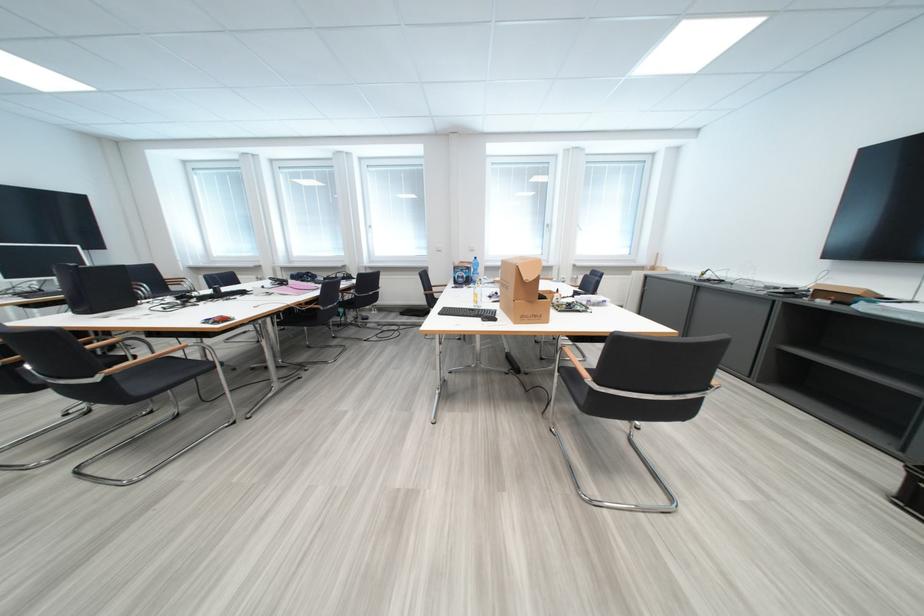
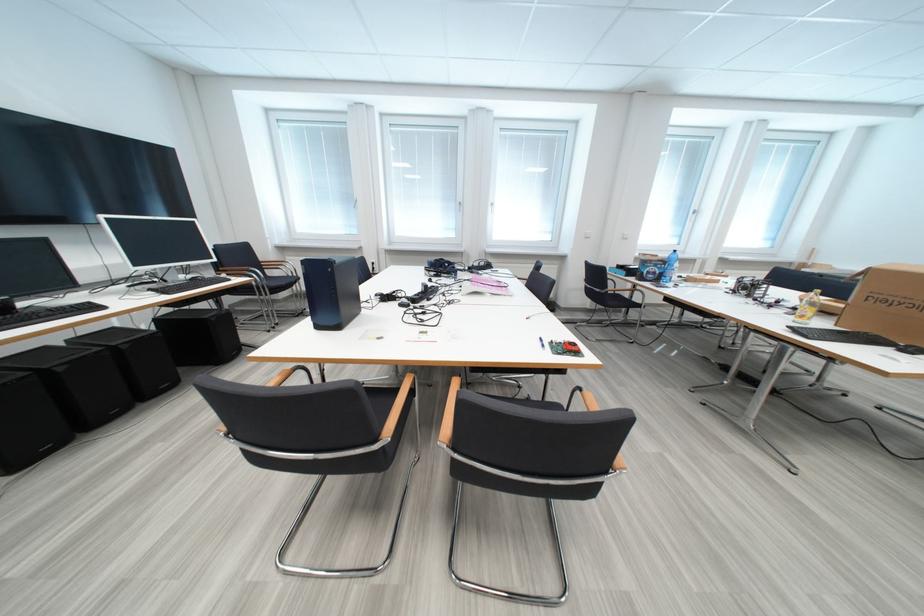
Question: Which direction would the cameraman need to move to produce the second image? Reply with the corresponding letter.

Choices:
 (A) Left
 (B) Right
 (C) Forward
 (D) Backward

Answer: (A)